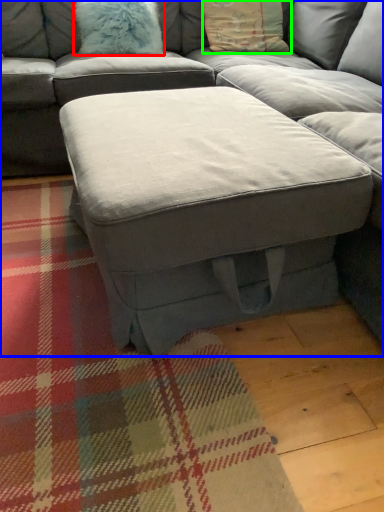
Question: Considering the real-world distances, which object is farthest from pillow (highlighted by a red box)? studio couch (highlighted by a blue box) or pillow (highlighted by a green box)?

Choices:
 (A) studio couch
 (B) pillow

Answer: (A)